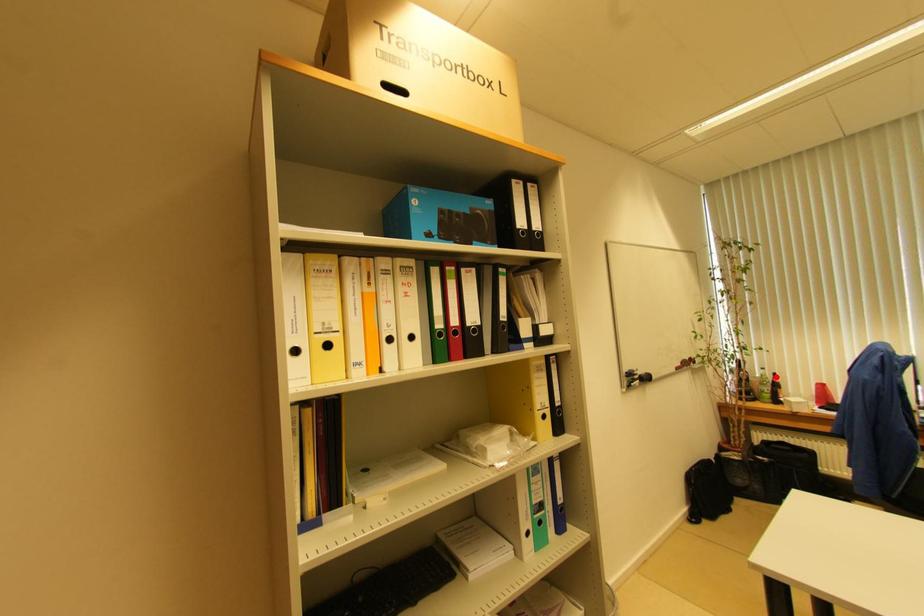
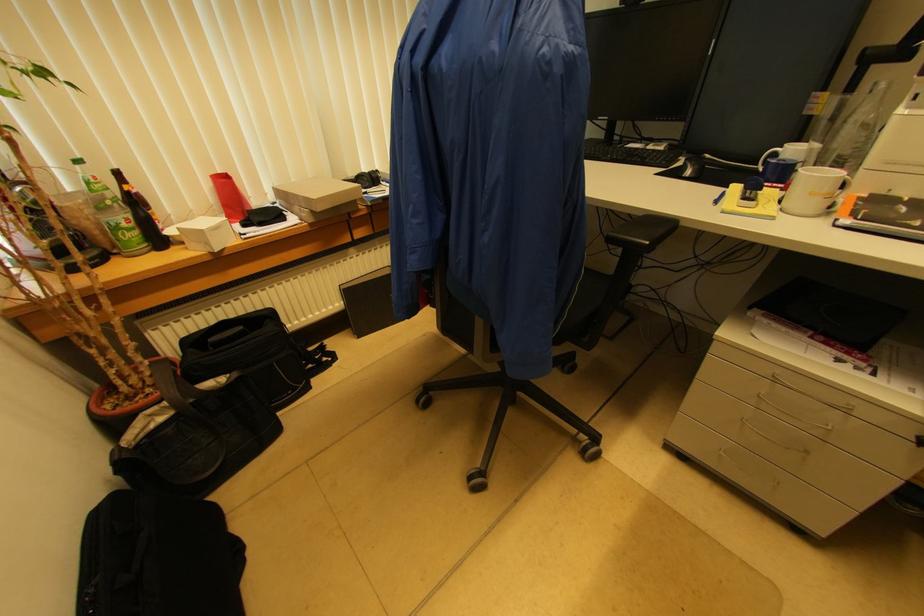
Find the pixel in the second image that matches the highlighted location in the first image.

(118, 176)